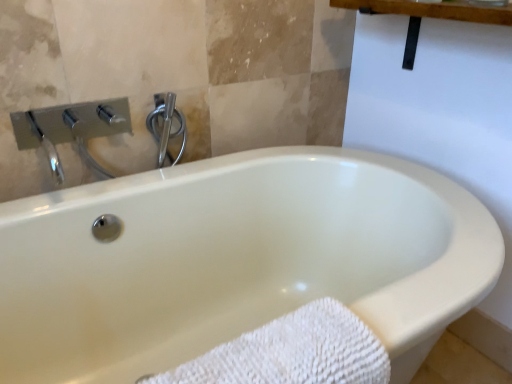
Question: Looking at the image, does chrome/metallic shower handle at upper center seem bigger or smaller compared to white textured towel at lower left?

Choices:
 (A) big
 (B) small

Answer: (B)

Question: From the image's perspective, is chrome/metallic shower handle at upper center above or below white textured towel at lower left?

Choices:
 (A) above
 (B) below

Answer: (A)

Question: Visually, is chrome/metallic shower handle at upper center positioned to the left or to the right of white textured towel at lower left?

Choices:
 (A) right
 (B) left

Answer: (B)

Question: From the image's perspective, is white textured towel at lower left located above or below chrome/metallic shower handle at upper center?

Choices:
 (A) above
 (B) below

Answer: (B)

Question: From a real-world perspective, is white textured towel at lower left physically located above or below chrome/metallic shower handle at upper center?

Choices:
 (A) above
 (B) below

Answer: (B)

Question: Looking at their shapes, would you say white textured towel at lower left is wider or thinner than chrome/metallic shower handle at upper center?

Choices:
 (A) wide
 (B) thin

Answer: (A)

Question: In terms of height, does white textured towel at lower left look taller or shorter compared to chrome/metallic shower handle at upper center?

Choices:
 (A) short
 (B) tall

Answer: (B)